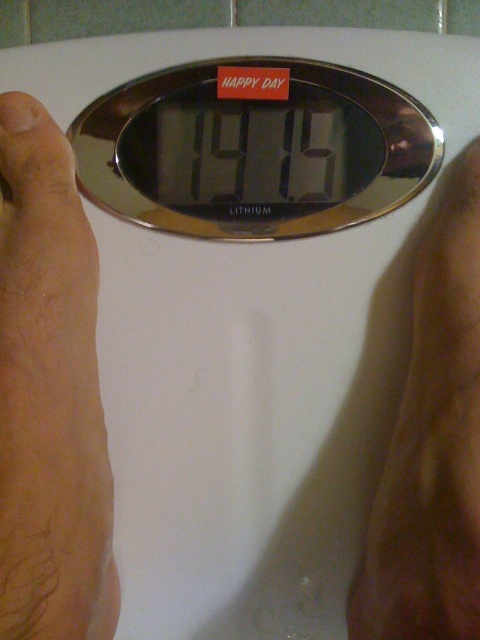
Consider the image. Is the position of skinny flesh at left more distant than that of brown leather hand at lower right?

That is False.

Is skinny flesh at left bigger than brown leather hand at lower right?

Correct, skinny flesh at left is larger in size than brown leather hand at lower right.

Which is in front, point (52, 136) or point (430, 266)?

Point (430, 266) is more forward.

Where is `skinny flesh at left`? The width and height of the screenshot is (480, 640). skinny flesh at left is located at coordinates (49, 396).